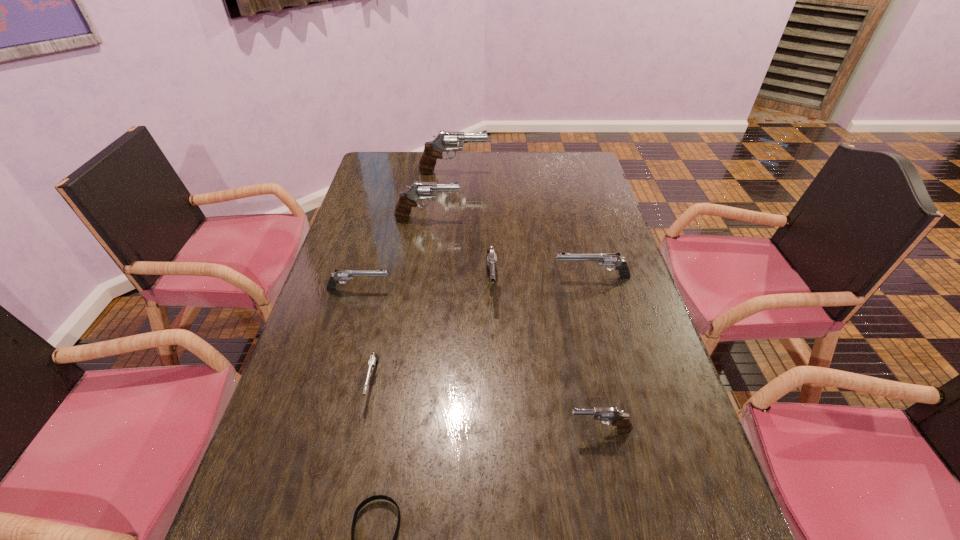
Select which pistol is the third closest to the wristband. Please provide its 2D coordinates. Your answer should be formatted as a tuple, i.e. [(x, y)], where the tuple contains the x and y coordinates of a point satisfying the conditions above.

[(491, 259)]

Where is `the third closest pistol to the farthest gray pistol`? the third closest pistol to the farthest gray pistol is located at coordinates 604,259.

Locate which gray pistol ranks second in proximity to the third farthest gray pistol. Please provide its 2D coordinates. Your answer should be formatted as a tuple, i.e. [(x, y)], where the tuple contains the x and y coordinates of a point satisfying the conditions above.

[(621, 419)]

Locate an element on the screen. The width and height of the screenshot is (960, 540). gray pistol identified as the closest to the nearest object is located at coordinates (621, 419).

Locate which silver pistol is the second closest to the sixth nearest pistol. Please provide its 2D coordinates. Your answer should be formatted as a tuple, i.e. [(x, y)], where the tuple contains the x and y coordinates of a point satisfying the conditions above.

[(604, 259)]

You are a GUI agent. You are given a task and a screenshot of the screen. Output one action in this format:
    pyautogui.click(x=<x>, y=<y>)
    Task: Click on the second closest silver pistol to the farthest object
    The height and width of the screenshot is (540, 960).
    Given the screenshot: What is the action you would take?
    pyautogui.click(x=339, y=275)